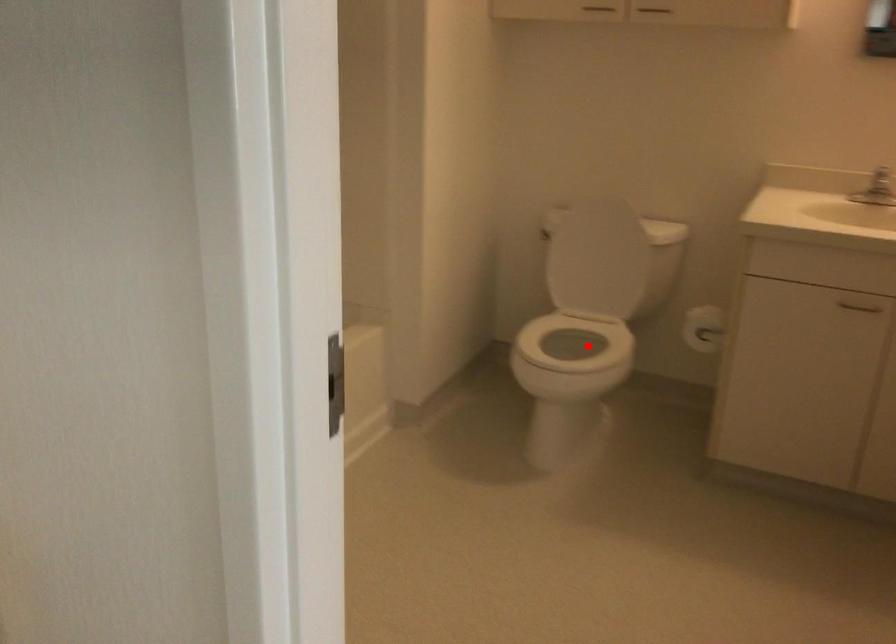
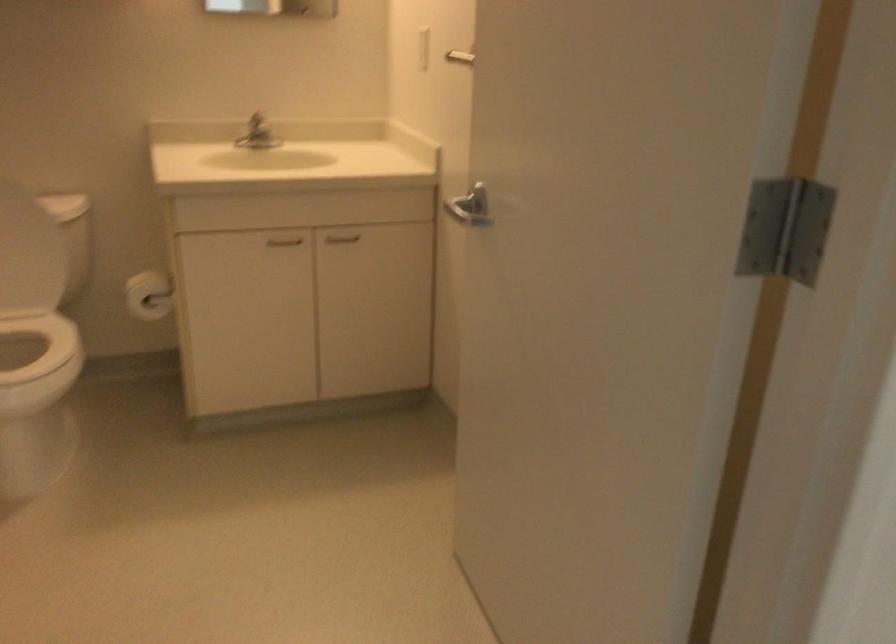
Find the pixel in the second image that matches the highlighted location in the first image.

(22, 341)